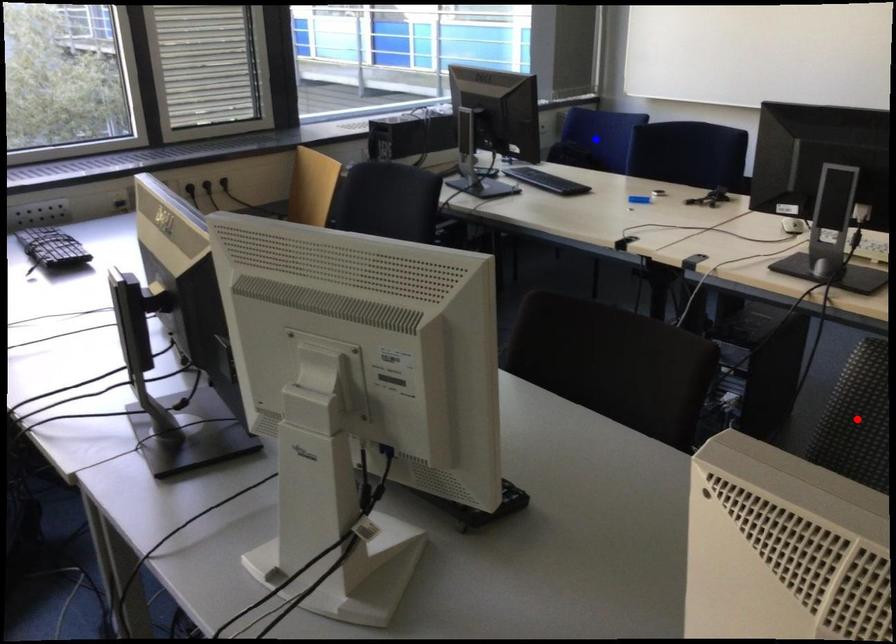
Question: Which of the two points in the image is closer to the camera?

Choices:
 (A) Blue point is closer.
 (B) Red point is closer.

Answer: (B)